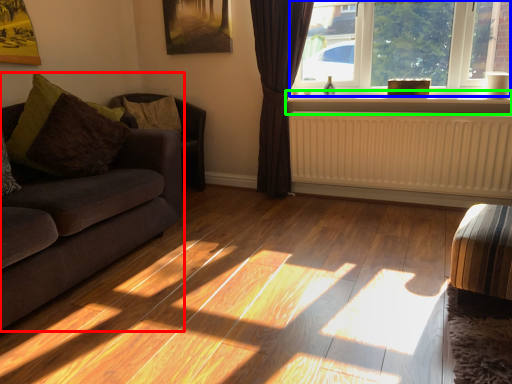
Question: Considering the real-world distances, which object is closest to studio couch (highlighted by a red box)? window (highlighted by a blue box) or window sill (highlighted by a green box).

Choices:
 (A) window
 (B) window sill

Answer: (B)